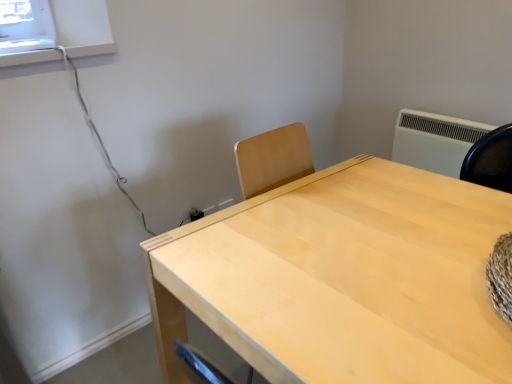
Question: Is white plastic air conditioning unit at upper right outside light wood table at center?

Choices:
 (A) yes
 (B) no

Answer: (A)

Question: Is white plastic air conditioning unit at upper right closer to the viewer compared to light wood table at center?

Choices:
 (A) no
 (B) yes

Answer: (A)

Question: Is white plastic air conditioning unit at upper right turned away from light wood table at center?

Choices:
 (A) no
 (B) yes

Answer: (A)

Question: Is white plastic air conditioning unit at upper right placed right next to light wood table at center?

Choices:
 (A) yes
 (B) no

Answer: (B)

Question: From the image's perspective, is white plastic air conditioning unit at upper right located above light wood table at center?

Choices:
 (A) yes
 (B) no

Answer: (A)

Question: From the image's perspective, would you say white plastic air conditioning unit at upper right is shown under light wood table at center?

Choices:
 (A) no
 (B) yes

Answer: (A)

Question: Is light wood table at center not close to white plastic air conditioning unit at upper right?

Choices:
 (A) yes
 (B) no

Answer: (B)

Question: Is light wood table at center thinner than white plastic air conditioning unit at upper right?

Choices:
 (A) no
 (B) yes

Answer: (A)

Question: Does light wood table at center have a lesser height compared to white plastic air conditioning unit at upper right?

Choices:
 (A) no
 (B) yes

Answer: (A)

Question: Would you say light wood table at center contains white plastic air conditioning unit at upper right?

Choices:
 (A) yes
 (B) no

Answer: (B)

Question: Is light wood table at center at the right side of white plastic air conditioning unit at upper right?

Choices:
 (A) yes
 (B) no

Answer: (B)

Question: Could you tell me if light wood table at center is facing white plastic air conditioning unit at upper right?

Choices:
 (A) no
 (B) yes

Answer: (A)

Question: Considering the positions of white plastic air conditioning unit at upper right and light wood table at center in the image, is white plastic air conditioning unit at upper right bigger or smaller than light wood table at center?

Choices:
 (A) big
 (B) small

Answer: (B)